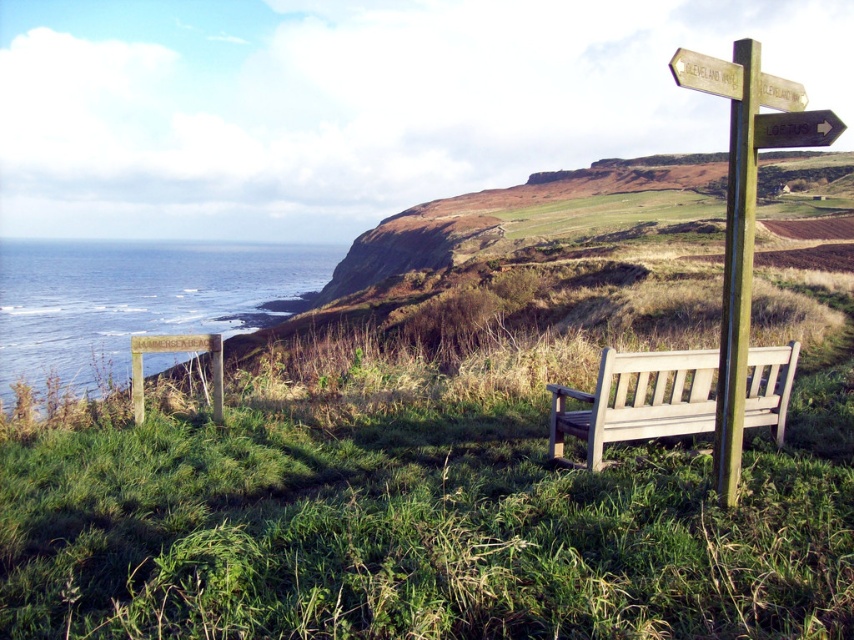
Who is positioned more to the right, blue water at left or wooden bench at right?

wooden bench at right is more to the right.

Who is more forward, (72, 250) or (597, 460)?

Positioned in front is point (597, 460).

At what (x,y) coordinates should I click in order to perform the action: click on blue water at left. Please return your answer as a coordinate pair (x, y). Looking at the image, I should click on (136, 300).

Identify the location of blue water at left. (136, 300).

Can you confirm if wooden signpost at center-right is smaller than black plastic arrow at upper right?

Actually, wooden signpost at center-right might be larger than black plastic arrow at upper right.

Measure the distance between wooden signpost at center-right and camera.

wooden signpost at center-right and camera are 13.03 feet apart.

Which is behind, point (671, 61) or point (798, 131)?

The point (798, 131) is behind.

This screenshot has height=640, width=854. Identify the location of wooden signpost at center-right. (735, 227).

Is point (173, 280) in front of point (759, 124)?

No, (173, 280) is further to viewer.

Does blue water at left have a lesser width compared to black plastic arrow at upper right?

No.

In order to click on blue water at left in this screenshot , I will do `click(136, 300)`.